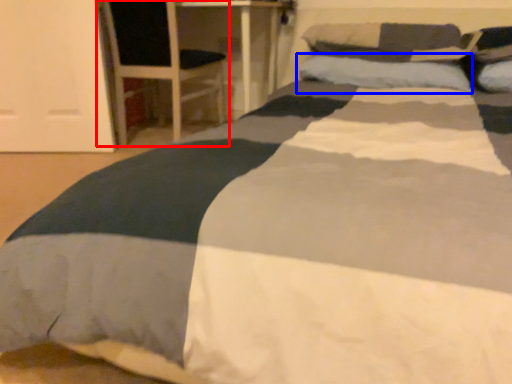
Question: Which of the following is the closest to the observer, armchair (highlighted by a red box) or pillow (highlighted by a blue box)?

Choices:
 (A) armchair
 (B) pillow

Answer: (B)